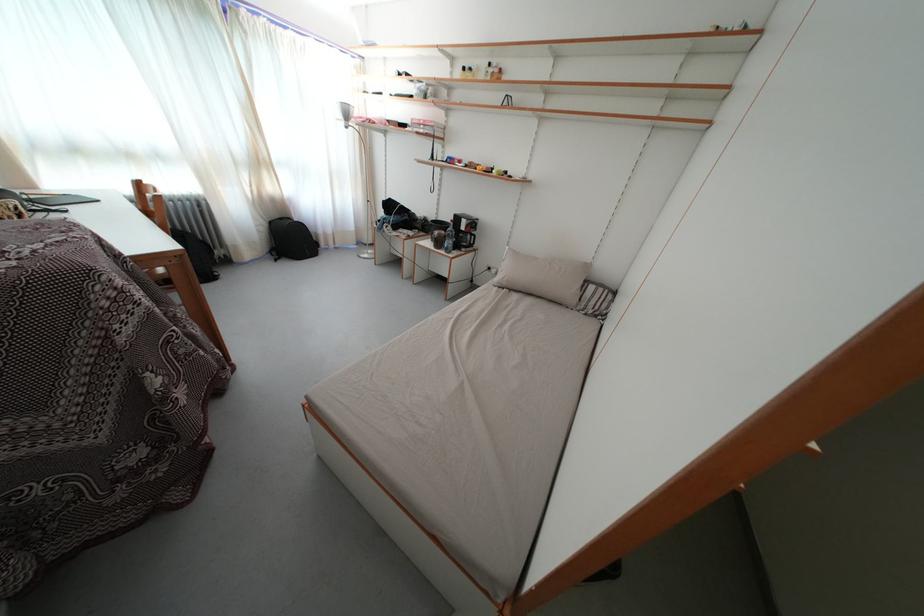
Which object does [292,238] point to?

It refers to a black backpack.